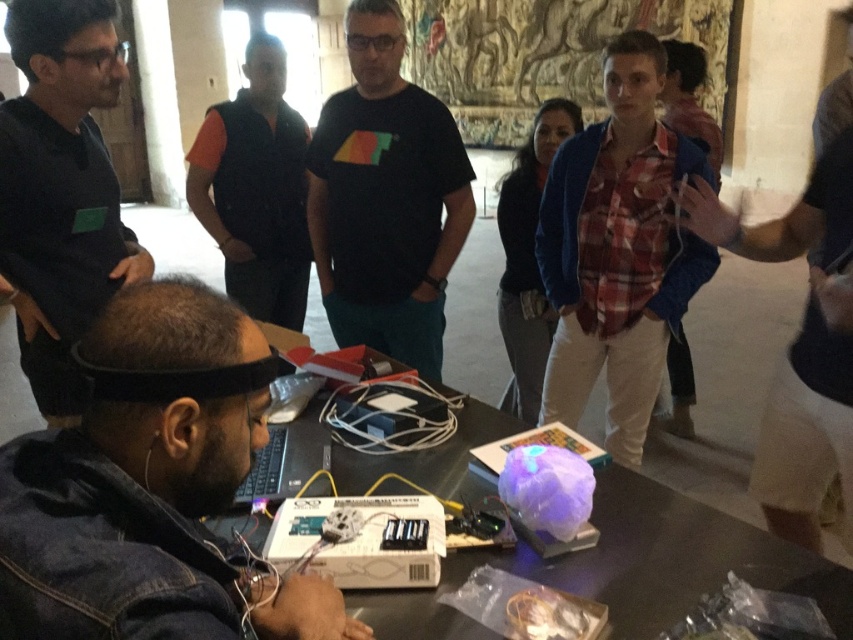
Consider the image. Can you confirm if metallic table at center is positioned to the right of black matte shirt at upper left?

Yes, metallic table at center is to the right of black matte shirt at upper left.

Is metallic table at center shorter than black matte shirt at upper left?

Yes, metallic table at center is shorter than black matte shirt at upper left.

Find the location of `metallic table at center`. metallic table at center is located at coordinates (666, 560).

At what (x,y) coordinates should I click in order to perform the action: click on denim jacket at lower left. Please return your answer as a coordinate pair (x, y). Looking at the image, I should click on (123, 520).

Measure the distance from denim jacket at lower left to black matte shirt at upper left.

The distance of denim jacket at lower left from black matte shirt at upper left is 3.78 feet.

Is point (200, 513) positioned after point (39, 211)?

No, it is not.

You are a GUI agent. You are given a task and a screenshot of the screen. Output one action in this format:
    pyautogui.click(x=<x>, y=<y>)
    Task: Click on the denim jacket at lower left
    The image size is (853, 640).
    Given the screenshot: What is the action you would take?
    [x=123, y=520]

Who is positioned more to the right, denim jacket at lower left or black matte t-shirt at center?

black matte t-shirt at center is more to the right.

Is point (94, 506) closer to viewer compared to point (437, 113)?

Yes, it is.

The image size is (853, 640). What do you see at coordinates (123, 520) in the screenshot? I see `denim jacket at lower left` at bounding box center [123, 520].

This screenshot has width=853, height=640. I want to click on denim jacket at lower left, so click(x=123, y=520).